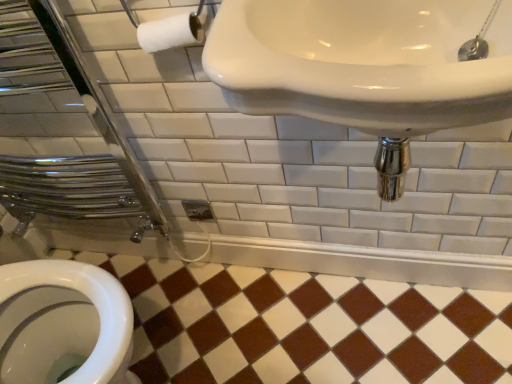
Question: Should I look upward or downward to see white glossy sink at upper center?

Choices:
 (A) up
 (B) down

Answer: (A)